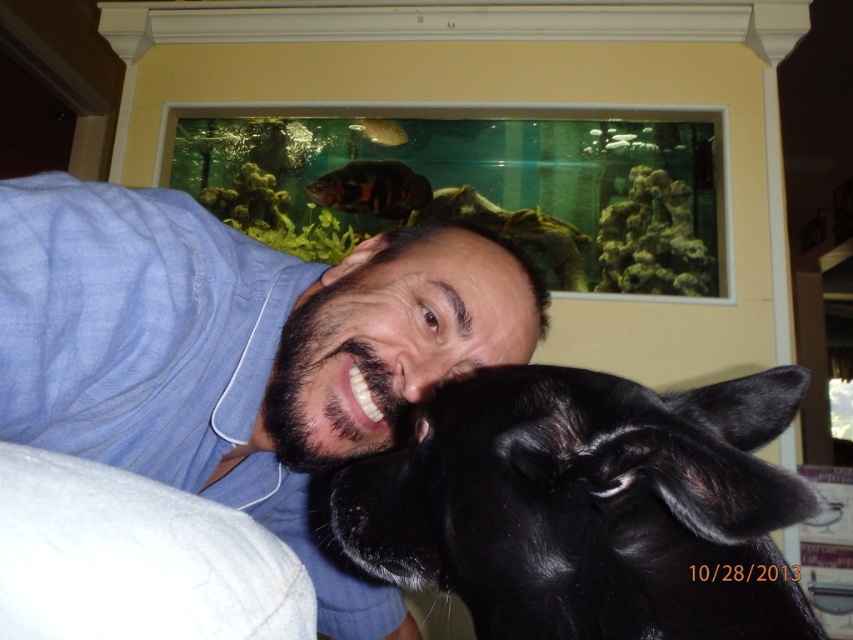
You are standing in the room where the man and his dog are. You want to place a small decoration between the point at coordinates point (x=4, y=332) and point (x=531, y=390). Which point is closer to you so that the decoration can be placed in front?

Point (x=4, y=332) is further to the viewer than point (x=531, y=390), so the decoration should be placed closer to point (x=531, y=390) to ensure it is in front.

You are an animal trainer observing the scene. You need to determine which object is shorter between the black shiny fur at center and the shiny black fish at upper center. Which one is shorter?

The black shiny fur at center is shorter than the shiny black fish at upper center.

You are a photographer trying to capture a photo of the shiny black fish at upper center while ensuring the blue cotton shirt at center is visible in the background. Based on their positions, will the fish be above or below the shirt in the final photo?

The blue cotton shirt at center is below shiny black fish at upper center, so in the photo the shiny black fish at upper center will be above the blue cotton shirt at center.